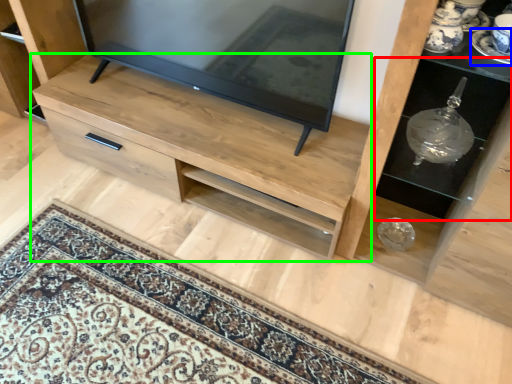
Question: Which object is positioned closest to shelf (highlighted by a red box)? Select from saucer (highlighted by a blue box) and chest of drawers (highlighted by a green box).

Choices:
 (A) saucer
 (B) chest of drawers

Answer: (A)